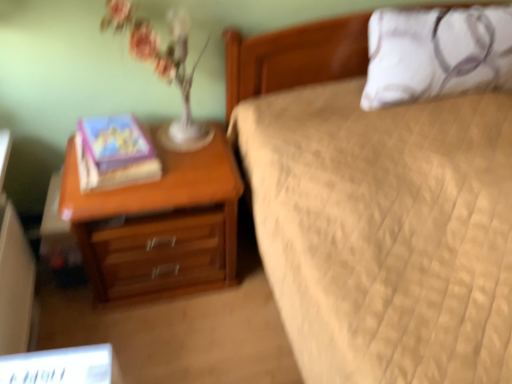
The height and width of the screenshot is (384, 512). What are the coordinates of `free point above wooden nightstand at left (from a real-world perspective)` in the screenshot? It's located at 162,155.